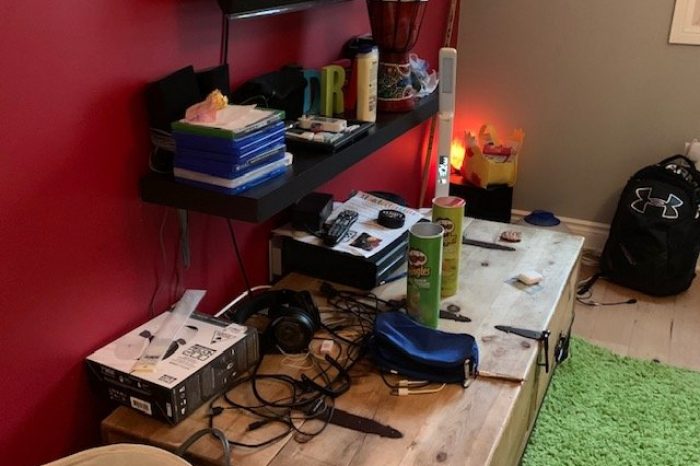
Find the location of a particular element. Image resolution: width=700 pixels, height=466 pixels. red wall is located at coordinates (101, 226).